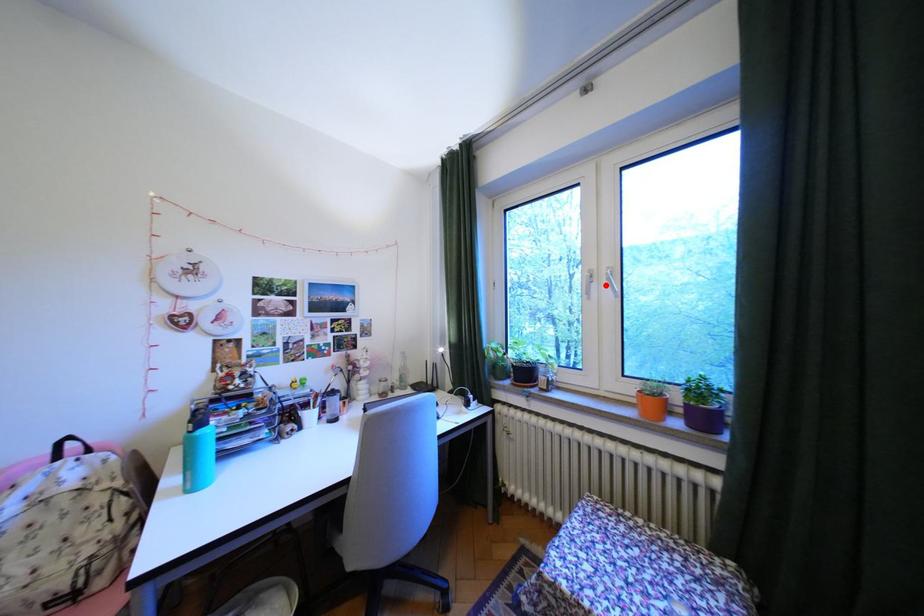
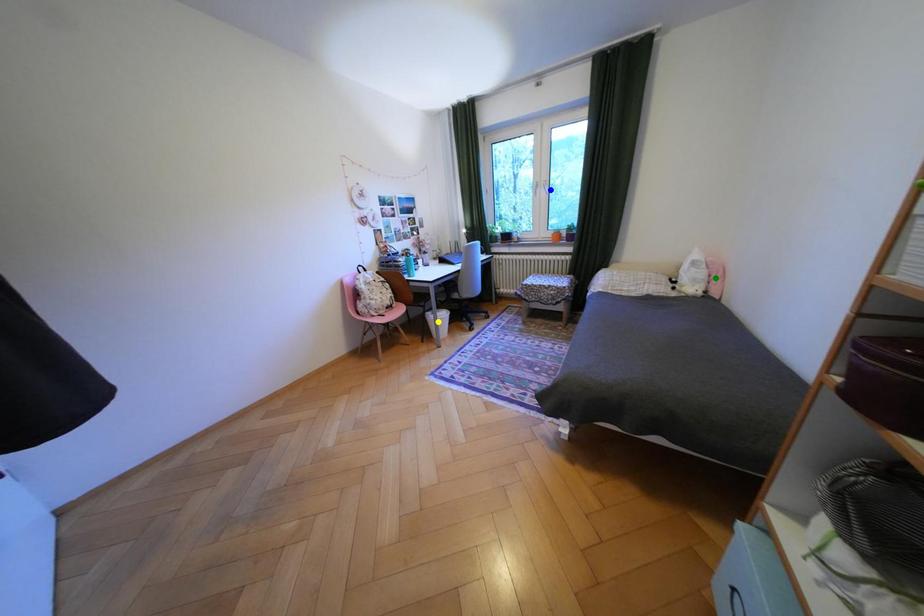
Question: I am providing you with two images of the same scene from different viewpoints. A red point is marked on the first image. You are given multiple points on the second image. Which point in image 2 represents the same 3d spot as the red point in image 1?

Choices:
 (A) yellow point
 (B) blue point
 (C) green point

Answer: (B)